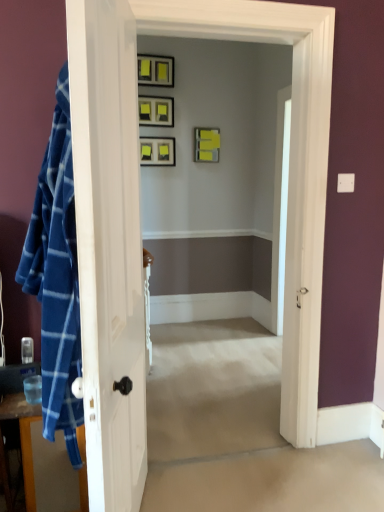
Question: Is matte black picture frame at upper center, arranged as the second picture frame when viewed from the top, not within blue plaid fabric at left?

Choices:
 (A) no
 (B) yes

Answer: (B)

Question: From a real-world perspective, is matte black picture frame at upper center, the third picture frame positioned from the bottom, located beneath blue plaid fabric at left?

Choices:
 (A) yes
 (B) no

Answer: (B)

Question: Can you confirm if matte black picture frame at upper center, the third picture frame positioned from the bottom, is positioned to the right of blue plaid fabric at left?

Choices:
 (A) yes
 (B) no

Answer: (A)

Question: Considering the relative sizes of matte black picture frame at upper center, arranged as the second picture frame when viewed from the top, and blue plaid fabric at left in the image provided, is matte black picture frame at upper center, arranged as the second picture frame when viewed from the top, wider than blue plaid fabric at left?

Choices:
 (A) no
 (B) yes

Answer: (A)

Question: Does matte black picture frame at upper center, the third picture frame positioned from the bottom, have a greater height compared to blue plaid fabric at left?

Choices:
 (A) no
 (B) yes

Answer: (A)

Question: In the image, is matte black picture frame at upper center, which appears as the first picture frame when viewed from the top, on the left side or the right side of blue plaid fabric at left?

Choices:
 (A) left
 (B) right

Answer: (B)

Question: From a real-world perspective, is matte black picture frame at upper center, which appears as the first picture frame when viewed from the top, positioned above or below blue plaid fabric at left?

Choices:
 (A) above
 (B) below

Answer: (A)

Question: In terms of width, does matte black picture frame at upper center, which appears as the first picture frame when viewed from the top, look wider or thinner when compared to blue plaid fabric at left?

Choices:
 (A) thin
 (B) wide

Answer: (A)

Question: From the image's perspective, is matte black picture frame at upper center, which appears as the first picture frame when viewed from the top, positioned above or below blue plaid fabric at left?

Choices:
 (A) above
 (B) below

Answer: (A)

Question: Considering the positions of matte black picture frame at center, marked as the 4th picture frame in a top-to-bottom arrangement, and matte black picture frame at upper center, marked as the 4th picture frame in a bottom-to-top arrangement, in the image, is matte black picture frame at center, marked as the 4th picture frame in a top-to-bottom arrangement, bigger or smaller than matte black picture frame at upper center, marked as the 4th picture frame in a bottom-to-top arrangement,?

Choices:
 (A) big
 (B) small

Answer: (B)

Question: Would you say matte black picture frame at center, marked as the 4th picture frame in a top-to-bottom arrangement, is to the left or to the right of matte black picture frame at upper center, marked as the 4th picture frame in a bottom-to-top arrangement, in the picture?

Choices:
 (A) left
 (B) right

Answer: (B)

Question: Looking at their shapes, would you say matte black picture frame at center, marked as the 4th picture frame in a top-to-bottom arrangement, is wider or thinner than matte black picture frame at upper center, marked as the 4th picture frame in a bottom-to-top arrangement?

Choices:
 (A) thin
 (B) wide

Answer: (A)

Question: Choose the correct answer: Is matte black picture frame at center, marked as the 4th picture frame in a top-to-bottom arrangement, inside matte black picture frame at upper center, which appears as the first picture frame when viewed from the top, or outside it?

Choices:
 (A) outside
 (B) inside

Answer: (A)

Question: Based on their sizes in the image, would you say matte black picture frame at center, marked as the 4th picture frame in a top-to-bottom arrangement, is bigger or smaller than yellow matte picture frame at upper center, the second picture frame from the bottom?

Choices:
 (A) small
 (B) big

Answer: (A)

Question: Looking at their shapes, would you say matte black picture frame at center, the first picture frame when ordered from bottom to top, is wider or thinner than yellow matte picture frame at upper center, the second picture frame from the bottom?

Choices:
 (A) thin
 (B) wide

Answer: (A)